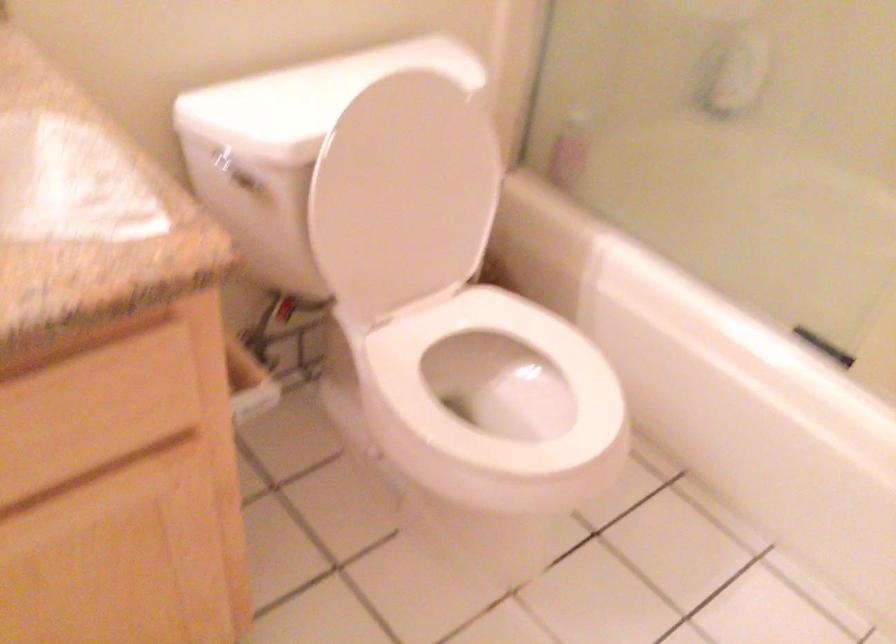
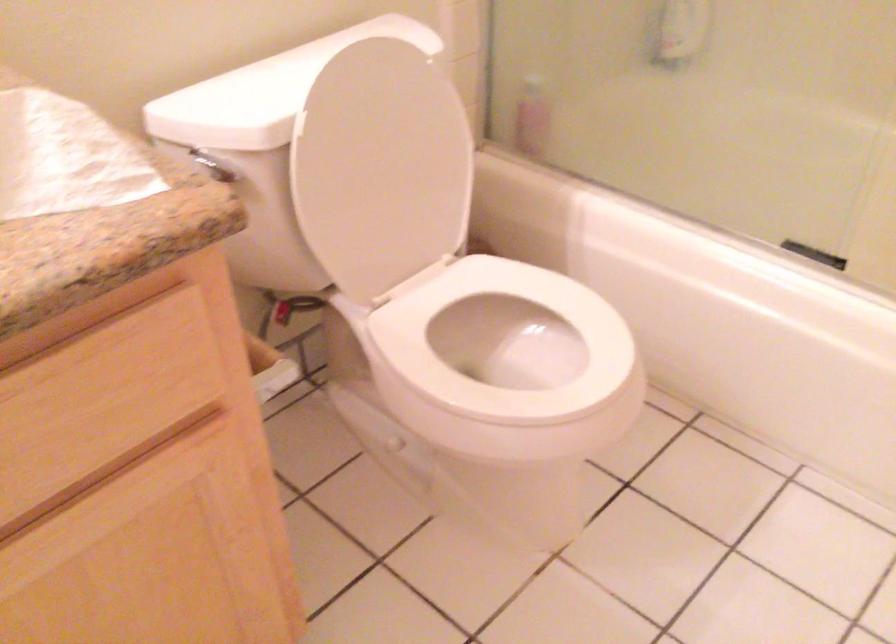
Locate, in the second image, the point that corresponds to point (99, 333) in the first image.

(117, 303)